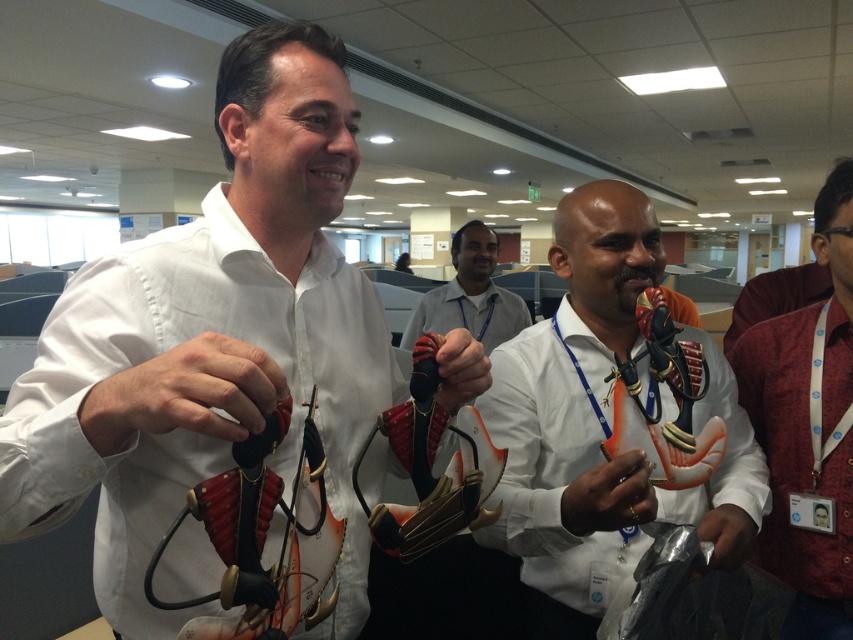
Question: Is white matte shirt at center thinner than matte black object at center?

Choices:
 (A) yes
 (B) no

Answer: (B)

Question: Which object appears closest to the camera in this image?

Choices:
 (A) white matte shirt at center
 (B) gold metallic ring at center
 (C) red textured shirt at right
 (D) matte black hand at center

Answer: (A)

Question: Observing the image, what is the correct spatial positioning of matte black object at center in reference to matte white shirt at center?

Choices:
 (A) above
 (B) below

Answer: (B)

Question: Which of the following is the farthest from the observer?

Choices:
 (A) (577, 509)
 (B) (727, 506)

Answer: (B)

Question: Based on their relative distances, which object is farther from the orange matte anatomical model at center?

Choices:
 (A) metallic gray glove at lower right
 (B) gold metallic ring at center
 (C) white matte shirt at center
 (D) matte white shirt at center

Answer: (D)

Question: Can you confirm if white matte shirt at center is thinner than matte black object at center?

Choices:
 (A) no
 (B) yes

Answer: (A)